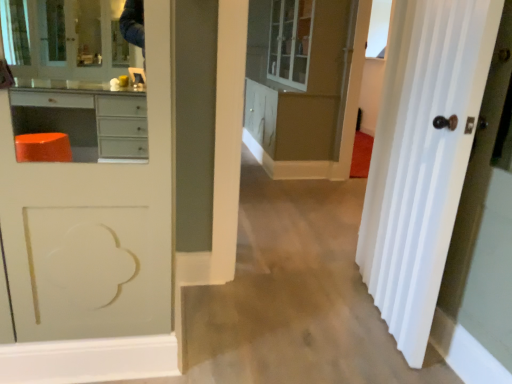
Question: Considering the positions of transparent glass window at upper right and white glossy door at right in the image, is transparent glass window at upper right taller or shorter than white glossy door at right?

Choices:
 (A) tall
 (B) short

Answer: (B)

Question: Is transparent glass window at upper right wider or thinner than white glossy door at right?

Choices:
 (A) thin
 (B) wide

Answer: (A)

Question: Estimate the real-world distances between objects in this image. Which object is closer to the white glossy door at right?

Choices:
 (A) matte white cabinet at center
 (B) transparent glass window at upper right

Answer: (A)

Question: Estimate the real-world distances between objects in this image. Which object is farther from the transparent glass window at upper right?

Choices:
 (A) matte white cabinet at center
 (B) white glossy door at right

Answer: (B)